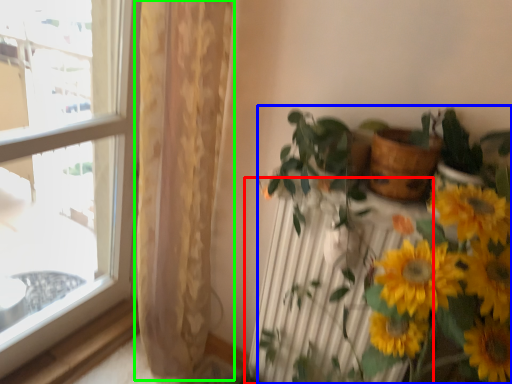
Question: Which object is positioned farthest from radiator (highlighted by a red box)? Select from houseplant (highlighted by a blue box) and curtain (highlighted by a green box).

Choices:
 (A) houseplant
 (B) curtain

Answer: (B)